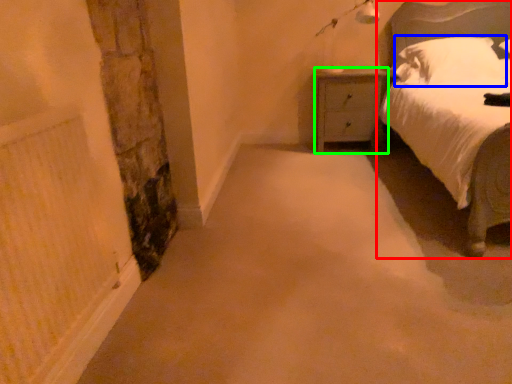
Question: Which is farther away from bed (highlighted by a red box)? pillow (highlighted by a blue box) or nightstand (highlighted by a green box)?

Choices:
 (A) pillow
 (B) nightstand

Answer: (B)